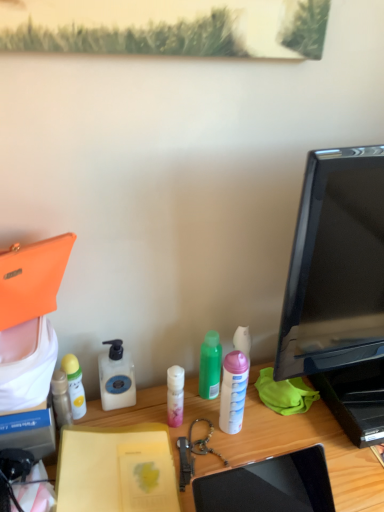
You are a GUI agent. You are given a task and a screenshot of the screen. Output one action in this format:
    pyautogui.click(x=<x>, y=<y>)
    Task: Click on the spots to the right of white matte spray can at center, arranged as the 5th bottle when viewed from the left
    Image resolution: width=384 pixels, height=512 pixels.
    Given the screenshot: What is the action you would take?
    pyautogui.click(x=299, y=439)